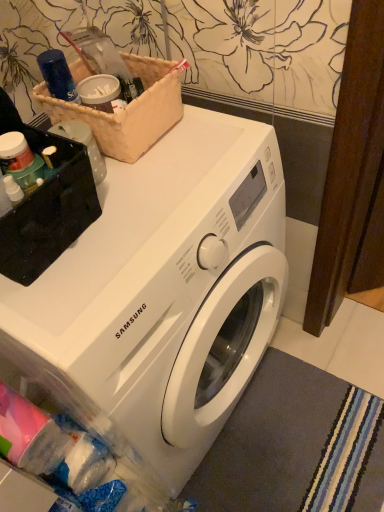
Question: From the image's perspective, is white glossy washing machine at center located above gray soft carpet at lower right?

Choices:
 (A) no
 (B) yes

Answer: (B)

Question: From the image's perspective, would you say white glossy washing machine at center is shown under gray soft carpet at lower right?

Choices:
 (A) yes
 (B) no

Answer: (B)

Question: Is white glossy washing machine at center not within gray soft carpet at lower right?

Choices:
 (A) no
 (B) yes

Answer: (B)

Question: Would you say white glossy washing machine at center is a long distance from gray soft carpet at lower right?

Choices:
 (A) no
 (B) yes

Answer: (A)

Question: Can you confirm if white glossy washing machine at center is positioned to the right of gray soft carpet at lower right?

Choices:
 (A) yes
 (B) no

Answer: (B)

Question: Does white glossy washing machine at center appear on the left side of gray soft carpet at lower right?

Choices:
 (A) yes
 (B) no

Answer: (A)

Question: Is gray soft carpet at lower right thinner than brown woven basket at upper left?

Choices:
 (A) yes
 (B) no

Answer: (B)

Question: Can you confirm if gray soft carpet at lower right is bigger than brown woven basket at upper left?

Choices:
 (A) no
 (B) yes

Answer: (A)

Question: Is gray soft carpet at lower right oriented away from brown woven basket at upper left?

Choices:
 (A) no
 (B) yes

Answer: (A)

Question: Is gray soft carpet at lower right not near brown woven basket at upper left?

Choices:
 (A) yes
 (B) no

Answer: (B)

Question: From the image's perspective, is gray soft carpet at lower right on brown woven basket at upper left?

Choices:
 (A) no
 (B) yes

Answer: (A)

Question: Are gray soft carpet at lower right and brown woven basket at upper left beside each other?

Choices:
 (A) no
 (B) yes

Answer: (A)

Question: Is gray soft carpet at lower right positioned with its back to white glossy washing machine at center?

Choices:
 (A) yes
 (B) no

Answer: (B)